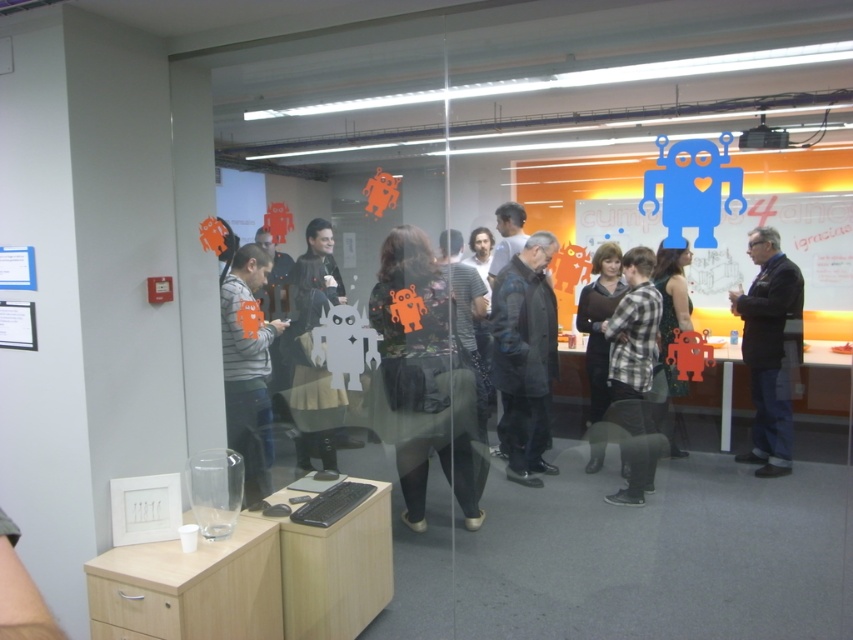
Where is the dark gray textured coat at center located in the image?

The dark gray textured coat at center is located at point coordinates of 0.558 on the x axis and 0.617 on the y axis.

You are an office worker who needs to identify clothing items in the scene. Which clothing item, the dark gray jacket at center or the plaid fabric shirt at center, is closer to the floor?

The dark gray jacket at center is positioned under the plaid fabric shirt at center, so the dark gray jacket at center is closer to the floor.